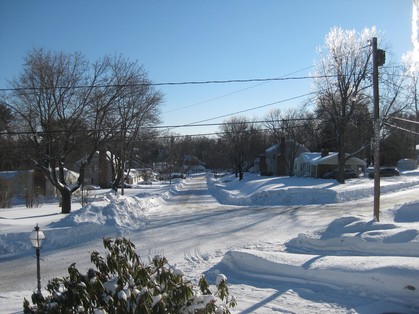
The image size is (419, 314). Identify the location of electric wiring. (281, 76), (232, 126), (408, 122), (405, 127).